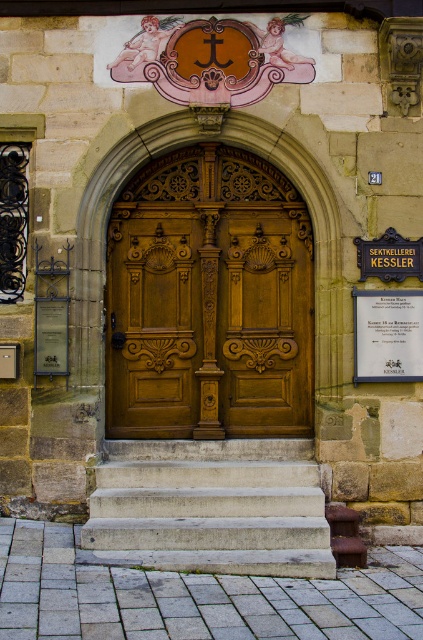
You are standing at the entrance of Sektkellerei Kessler and want to determine the relative positions of two points marked on the building facade. The first point is at coordinates point (118, 326) and the second is at point (209, 330). Which point is closer to you?

Point (118, 326) is closer to you because it is further to the viewer than point (209, 330).

You are a delivery person trying to enter the building. You have a large package that is 8 inches wide. Can you fit through the gap between the polished wood door at center and wooden door at center?

The gap between the polished wood door at center and wooden door at center is 7.77 inches. Since your package is 8 inches wide, it cannot fit through the gap as it is slightly narrower than the package.